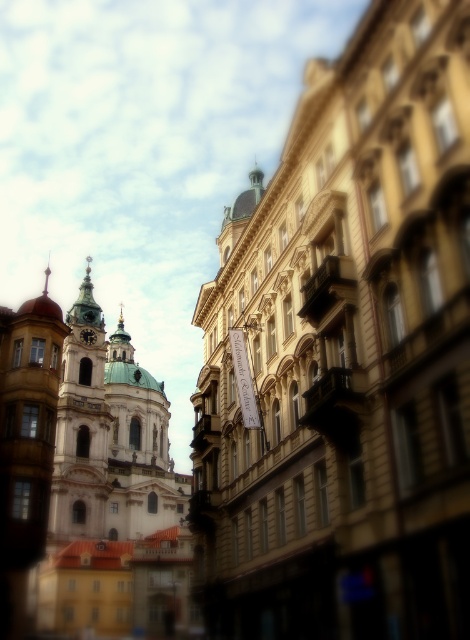
You are standing in the middle of the urban scene and want to take a photo. There are two points of interest marked as point 1 at coordinates (71, 424) and point 2 at coordinates (95, 339). Which point should you focus on first if you want to capture the closest object in your shot?

Point 1 at coordinates (71, 424) should be focused on first because it is closer to the camera than point 2 at coordinates (95, 339).